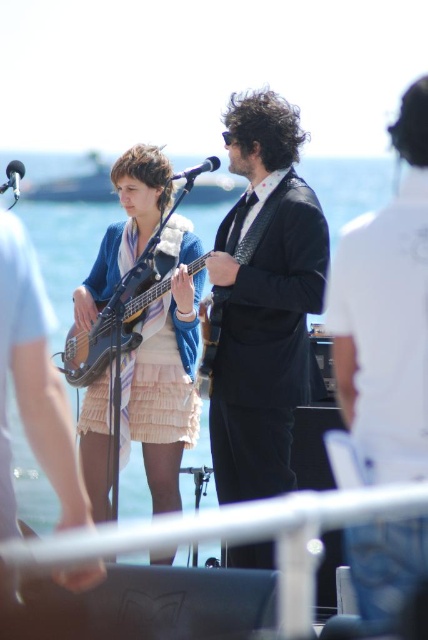
Does shiny black suit at center have a smaller size compared to pink ruffled skirt at center?

Correct, shiny black suit at center occupies less space than pink ruffled skirt at center.

Where is `shiny black suit at center`? shiny black suit at center is located at coordinates (261, 301).

Is shiny black suit at center positioned at the back of black suit at center?

Yes, it is.

Locate an element on the screen. shiny black suit at center is located at coordinates (261, 301).

Does point (237, 449) come in front of point (104, 348)?

No.

Does point (217, 416) come in front of point (151, 282)?

No.

Where is `shiny black suit at center`? This screenshot has width=428, height=640. shiny black suit at center is located at coordinates (261, 301).